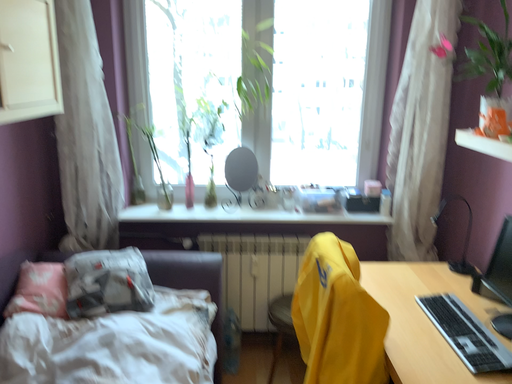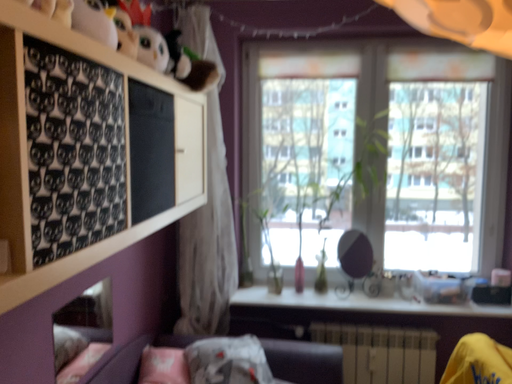
Question: How did the camera likely rotate when shooting the video?

Choices:
 (A) rotated left
 (B) rotated right

Answer: (A)